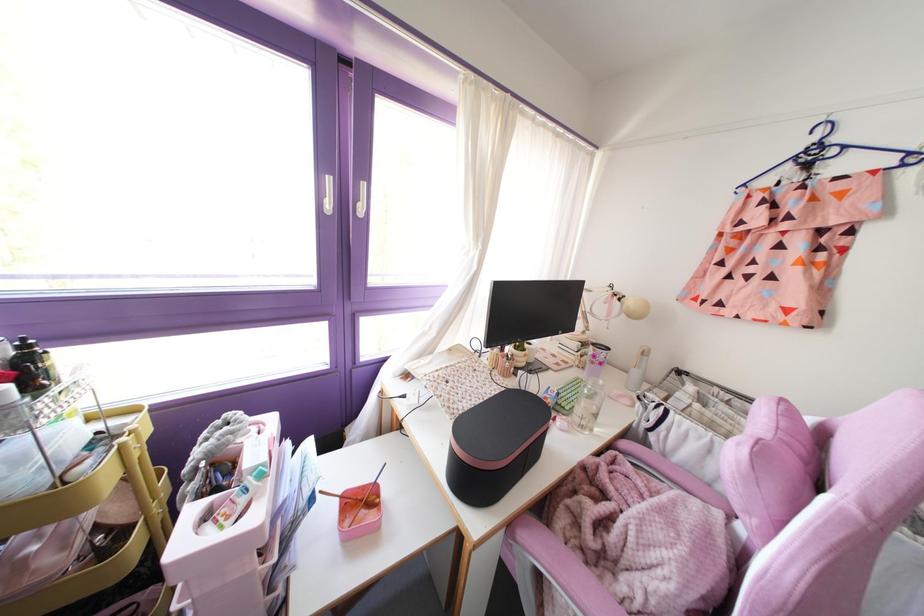
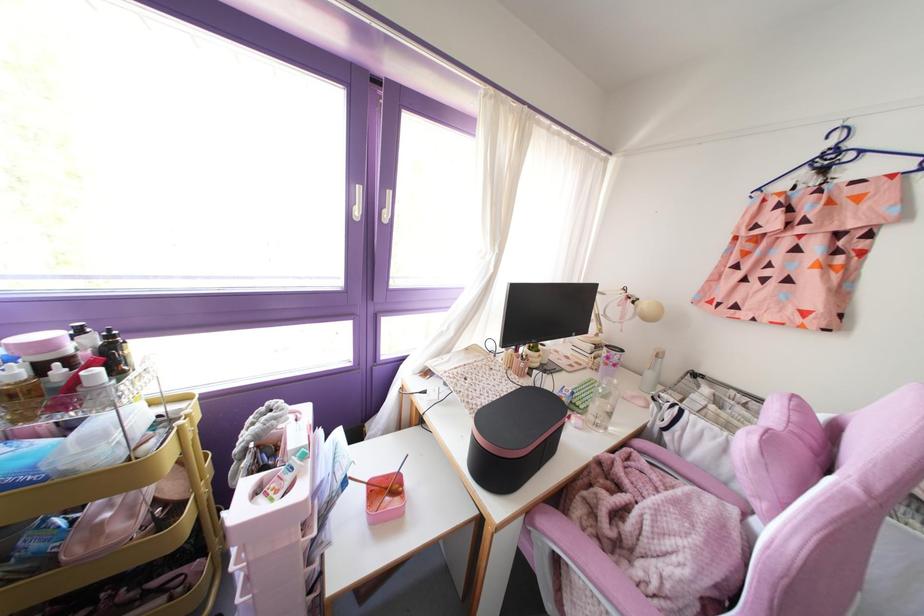
In the second image, find the point that corresponds to point 587,322 in the first image.

(600, 325)